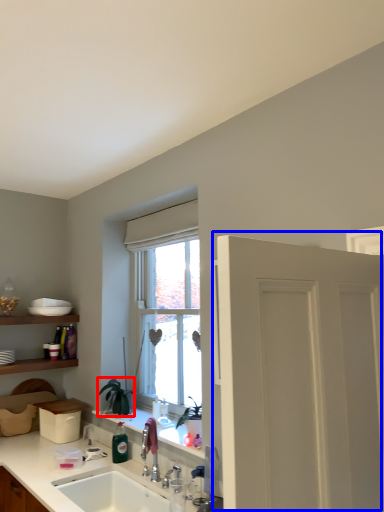
Question: Which of the following is the closest to the observer, plant (highlighted by a red box) or door (highlighted by a blue box)?

Choices:
 (A) plant
 (B) door

Answer: (B)